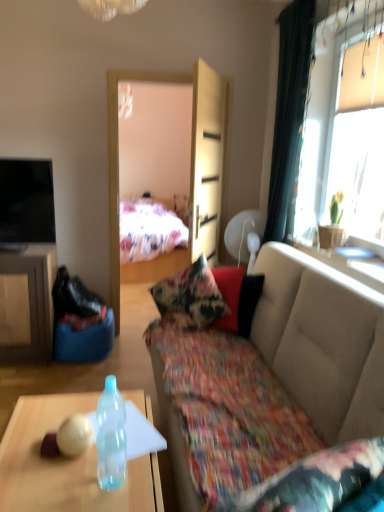
Question: From the image's perspective, is transparent plastic bottle at lower left above floral fabric couch at center?

Choices:
 (A) no
 (B) yes

Answer: (B)

Question: Can you confirm if transparent plastic bottle at lower left is taller than floral fabric couch at center?

Choices:
 (A) no
 (B) yes

Answer: (A)

Question: Considering the relative positions of transparent plastic bottle at lower left and floral fabric couch at center in the image provided, is transparent plastic bottle at lower left behind floral fabric couch at center?

Choices:
 (A) yes
 (B) no

Answer: (A)

Question: Can you confirm if transparent plastic bottle at lower left is thinner than floral fabric couch at center?

Choices:
 (A) no
 (B) yes

Answer: (B)

Question: From a real-world perspective, is transparent plastic bottle at lower left located beneath floral fabric couch at center?

Choices:
 (A) yes
 (B) no

Answer: (B)

Question: Can you confirm if transparent plastic bottle at lower left is bigger than floral fabric couch at center?

Choices:
 (A) no
 (B) yes

Answer: (A)

Question: Is transparent plastic bottle at lower left positioned in front of transparent glass table at upper right?

Choices:
 (A) yes
 (B) no

Answer: (A)

Question: Considering the relative sizes of transparent plastic bottle at lower left and transparent glass table at upper right in the image provided, is transparent plastic bottle at lower left taller than transparent glass table at upper right?

Choices:
 (A) yes
 (B) no

Answer: (A)

Question: Would you say transparent plastic bottle at lower left is a long distance from transparent glass table at upper right?

Choices:
 (A) yes
 (B) no

Answer: (A)

Question: Is transparent plastic bottle at lower left wider than transparent glass table at upper right?

Choices:
 (A) yes
 (B) no

Answer: (B)

Question: From a real-world perspective, is transparent plastic bottle at lower left located beneath transparent glass table at upper right?

Choices:
 (A) yes
 (B) no

Answer: (A)

Question: Is transparent plastic bottle at lower left to the right of transparent glass table at upper right from the viewer's perspective?

Choices:
 (A) yes
 (B) no

Answer: (B)

Question: Is light wood armoire at center taller than floral fabric couch at center?

Choices:
 (A) no
 (B) yes

Answer: (B)